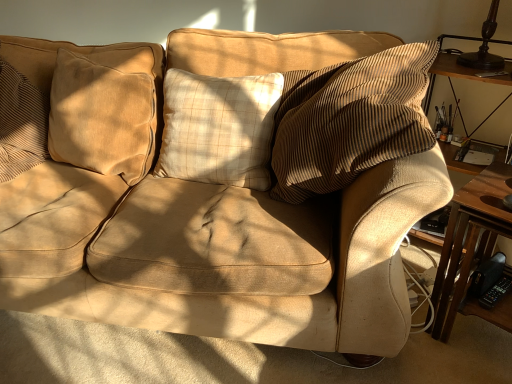
Question: Considering the positions of wooden table at right and suede-like beige pillow at left, placed as the 2th pillow when sorted from right to left, in the image, is wooden table at right wider or thinner than suede-like beige pillow at left, placed as the 2th pillow when sorted from right to left,?

Choices:
 (A) thin
 (B) wide

Answer: (B)

Question: Do you think wooden table at right is within suede-like beige pillow at left, marked as the 1th pillow in a left-to-right arrangement, or outside of it?

Choices:
 (A) outside
 (B) inside

Answer: (A)

Question: Estimate the real-world distances between objects in this image. Which object is closer to the beige plaid pillow at center, positioned as the 1th pillow in right-to-left order?

Choices:
 (A) suede-like beige pillow at left, placed as the 2th pillow when sorted from right to left
 (B) wooden table at right

Answer: (A)

Question: Which object is positioned closest to the wooden table at right?

Choices:
 (A) suede-like beige pillow at left, placed as the 2th pillow when sorted from right to left
 (B) beige plaid pillow at center, positioned as the 1th pillow in right-to-left order

Answer: (B)